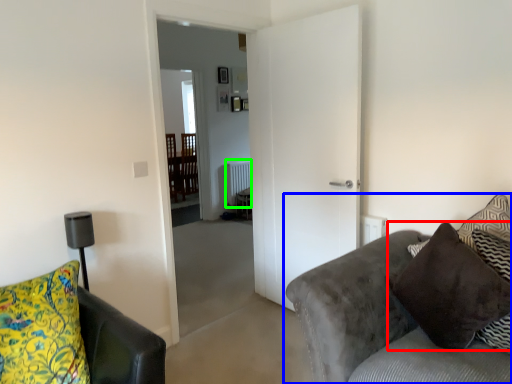
Question: Which is farther away from pillow (highlighted by a red box)? studio couch (highlighted by a blue box) or radiator (highlighted by a green box)?

Choices:
 (A) studio couch
 (B) radiator

Answer: (B)